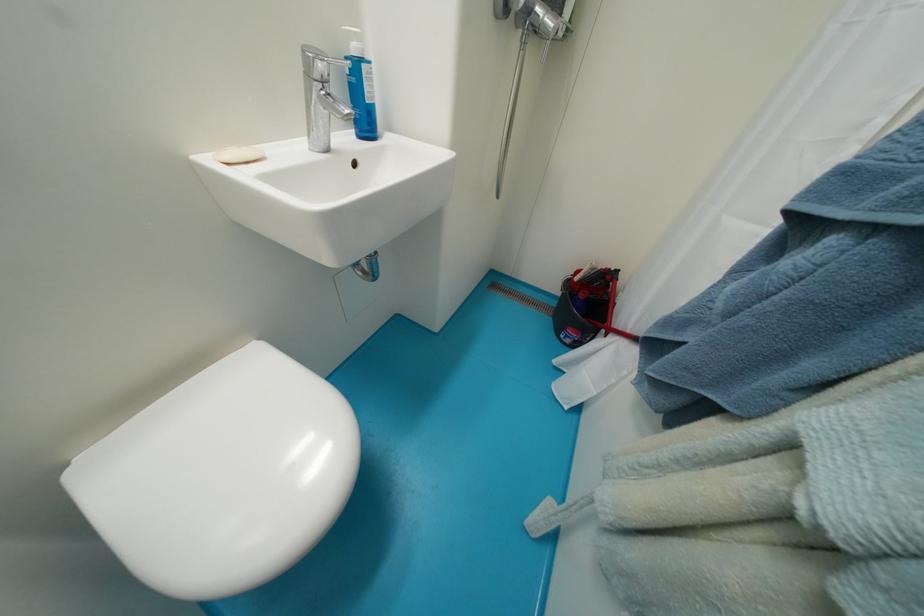
The width and height of the screenshot is (924, 616). What do you see at coordinates (360, 92) in the screenshot?
I see `the blue dispenser pump` at bounding box center [360, 92].